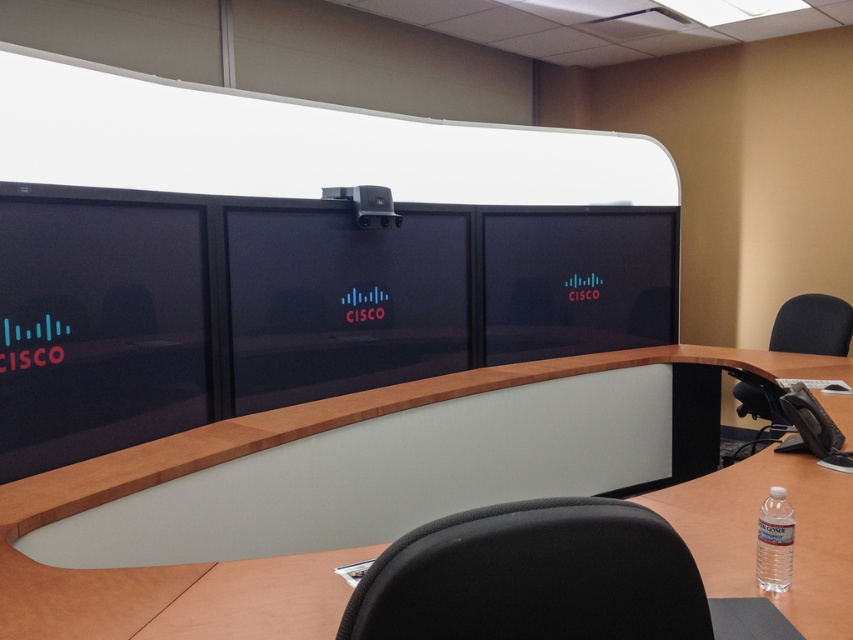
Question: Which of these objects is positioned farthest from the black glossy monitor at center?

Choices:
 (A) light brown wood table at center
 (B) black fabric swivel chair at lower center
 (C) clear plastic bottle at lower right
 (D) matte black monitor at center

Answer: (B)

Question: Does black glossy monitor at center appear on the left side of black fabric swivel chair at lower center?

Choices:
 (A) no
 (B) yes

Answer: (B)

Question: Which of the following is the farthest from the observer?

Choices:
 (A) black fabric swivel chair at lower center
 (B) light brown wood table at center

Answer: (B)

Question: Does light brown wood table at center appear under black glossy monitor at center?

Choices:
 (A) yes
 (B) no

Answer: (A)

Question: Observing the image, what is the correct spatial positioning of matte black monitor at left in reference to black glossy monitor at center?

Choices:
 (A) below
 (B) above

Answer: (A)

Question: Based on their relative distances, which object is farther from the black glossy monitor at center?

Choices:
 (A) light brown wood table at center
 (B) matte black monitor at center

Answer: (B)